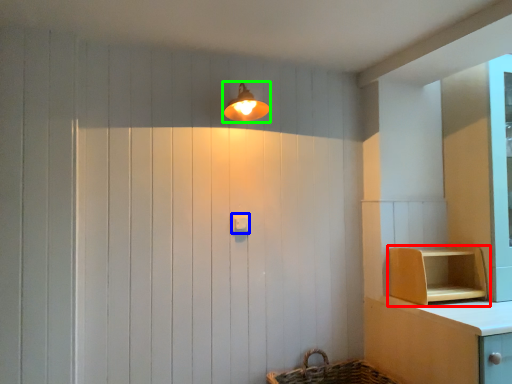
Question: Based on their relative distances, which object is farther from shelf (highlighted by a red box)? Choose from light switch (highlighted by a blue box) and light fixture (highlighted by a green box).

Choices:
 (A) light switch
 (B) light fixture

Answer: (B)